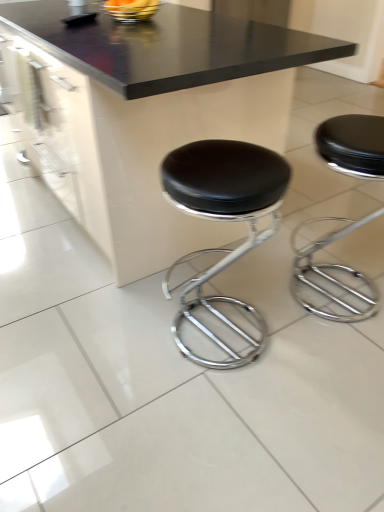
Question: Can you confirm if metallic silver bowl at upper center is taller than black leather stool at center, the second stool positioned from the right?

Choices:
 (A) no
 (B) yes

Answer: (A)

Question: Is metallic silver bowl at upper center in front of black leather stool at center, the second stool positioned from the right?

Choices:
 (A) no
 (B) yes

Answer: (A)

Question: Does metallic silver bowl at upper center have a lesser height compared to black leather stool at center, the second stool positioned from the right?

Choices:
 (A) yes
 (B) no

Answer: (A)

Question: Could you tell me if metallic silver bowl at upper center is facing black leather stool at center, the second stool positioned from the right?

Choices:
 (A) yes
 (B) no

Answer: (B)

Question: Does metallic silver bowl at upper center have a smaller size compared to black leather stool at center, the second stool positioned from the right?

Choices:
 (A) yes
 (B) no

Answer: (A)

Question: In terms of height, does black glossy table at center look taller or shorter compared to black leather stool at center, acting as the first stool starting from the right?

Choices:
 (A) short
 (B) tall

Answer: (B)

Question: Considering the positions of black glossy table at center and black leather stool at center, acting as the first stool starting from the right, in the image, is black glossy table at center bigger or smaller than black leather stool at center, acting as the first stool starting from the right,?

Choices:
 (A) big
 (B) small

Answer: (A)

Question: From the image's perspective, is black glossy table at center located above or below black leather stool at center, acting as the 2th stool starting from the left?

Choices:
 (A) below
 (B) above

Answer: (B)

Question: Based on their positions, is black glossy table at center located to the left or right of black leather stool at center, acting as the first stool starting from the right?

Choices:
 (A) right
 (B) left

Answer: (B)

Question: From the image's perspective, is black leather stool at center, acting as the 2th stool starting from the left, positioned above or below black leather stool at center, the second stool positioned from the right?

Choices:
 (A) above
 (B) below

Answer: (A)

Question: Is black leather stool at center, acting as the first stool starting from the right, inside the boundaries of black leather stool at center, the first stool in the left-to-right sequence, or outside?

Choices:
 (A) outside
 (B) inside

Answer: (A)

Question: From a real-world perspective, is black leather stool at center, acting as the first stool starting from the right, physically located above or below black leather stool at center, the second stool positioned from the right?

Choices:
 (A) above
 (B) below

Answer: (B)

Question: Is black leather stool at center, acting as the 2th stool starting from the left, in front of or behind black leather stool at center, the second stool positioned from the right, in the image?

Choices:
 (A) front
 (B) behind

Answer: (B)

Question: Considering their positions, is black leather stool at center, the first stool in the left-to-right sequence, located in front of or behind metallic silver bowl at upper center?

Choices:
 (A) front
 (B) behind

Answer: (A)

Question: Is black leather stool at center, the second stool positioned from the right, bigger or smaller than metallic silver bowl at upper center?

Choices:
 (A) small
 (B) big

Answer: (B)